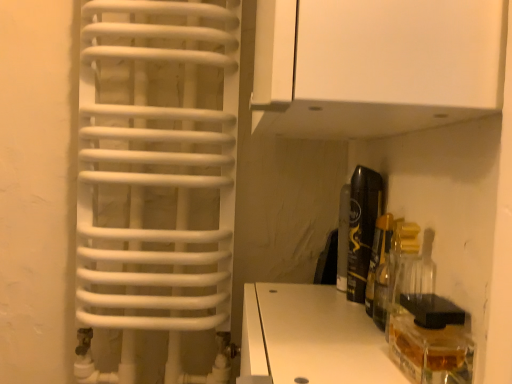
Question: From a real-world perspective, is black glossy can at right, the 2th bottle positioned from the front, over white matte cabinet at upper center?

Choices:
 (A) yes
 (B) no

Answer: (B)

Question: Can you confirm if black glossy can at right, which appears as the 1th bottle when viewed from the back, is smaller than white matte cabinet at upper center?

Choices:
 (A) yes
 (B) no

Answer: (A)

Question: Is black glossy can at right, which appears as the 1th bottle when viewed from the back, positioned with its back to white matte cabinet at upper center?

Choices:
 (A) no
 (B) yes

Answer: (A)

Question: From a real-world perspective, is black glossy can at right, the 2th bottle positioned from the front, physically below white matte cabinet at upper center?

Choices:
 (A) no
 (B) yes

Answer: (B)

Question: Is black glossy can at right, which appears as the 1th bottle when viewed from the back, surrounding white matte cabinet at upper center?

Choices:
 (A) yes
 (B) no

Answer: (B)

Question: In terms of size, does clear glass bottle at center right, acting as the 2th bottle starting from the back, appear bigger or smaller than white matte cabinet at upper center?

Choices:
 (A) small
 (B) big

Answer: (A)

Question: Considering the positions of clear glass bottle at center right, acting as the 2th bottle starting from the back, and white matte cabinet at upper center in the image, is clear glass bottle at center right, acting as the 2th bottle starting from the back, wider or thinner than white matte cabinet at upper center?

Choices:
 (A) wide
 (B) thin

Answer: (B)

Question: Would you say clear glass bottle at center right, which is the first bottle in front-to-back order, is inside or outside white matte cabinet at upper center?

Choices:
 (A) outside
 (B) inside

Answer: (A)

Question: Is clear glass bottle at center right, which is the first bottle in front-to-back order, in front of or behind white matte cabinet at upper center in the image?

Choices:
 (A) behind
 (B) front

Answer: (A)

Question: Visually, is white matte cabinet at upper center positioned to the left or to the right of clear glass bottle at center right, which is the first bottle in front-to-back order?

Choices:
 (A) right
 (B) left

Answer: (B)

Question: From the image's perspective, is white matte cabinet at upper center above or below clear glass bottle at center right, acting as the 2th bottle starting from the back?

Choices:
 (A) above
 (B) below

Answer: (A)

Question: Which is correct: white matte cabinet at upper center is inside clear glass bottle at center right, which is the first bottle in front-to-back order, or outside of it?

Choices:
 (A) outside
 (B) inside

Answer: (A)

Question: Considering their positions, is white matte cabinet at upper center located in front of or behind clear glass bottle at center right, acting as the 2th bottle starting from the back?

Choices:
 (A) behind
 (B) front

Answer: (B)

Question: Considering the positions of clear glass bottle at center right, which is the first bottle in front-to-back order, and black glossy can at right, the 2th bottle positioned from the front, in the image, is clear glass bottle at center right, which is the first bottle in front-to-back order, wider or thinner than black glossy can at right, the 2th bottle positioned from the front,?

Choices:
 (A) wide
 (B) thin

Answer: (A)

Question: From the image's perspective, is clear glass bottle at center right, acting as the 2th bottle starting from the back, above or below black glossy can at right, the 2th bottle positioned from the front?

Choices:
 (A) below
 (B) above

Answer: (A)